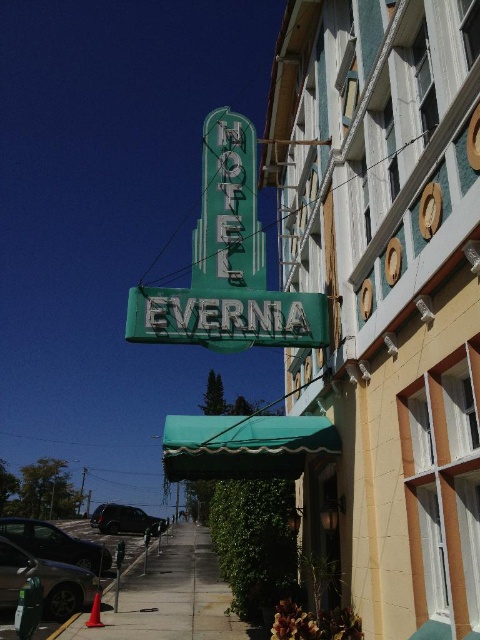
Does gray concrete sidewalk at lower center have a lesser height compared to shiny black suv at lower left?

Indeed, gray concrete sidewalk at lower center has a lesser height compared to shiny black suv at lower left.

Who is positioned more to the right, gray concrete sidewalk at lower center or shiny black suv at lower left?

Positioned to the right is gray concrete sidewalk at lower center.

Where is `gray concrete sidewalk at lower center`? gray concrete sidewalk at lower center is located at coordinates (170, 595).

Can you confirm if yellow brick building at center is wider than shiny black suv at lower left?

No.

In order to click on yellow brick building at center in this screenshot , I will do `click(386, 296)`.

Who is lower down, yellow brick building at center or gray concrete sidewalk at lower center?

gray concrete sidewalk at lower center

Does yellow brick building at center lie in front of gray concrete sidewalk at lower center?

Yes.

Find the location of a particular element. The image size is (480, 640). yellow brick building at center is located at coordinates (386, 296).